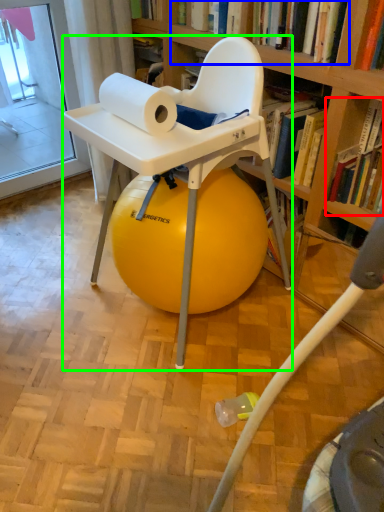
Question: Based on their relative distances, which object is farther from book (highlighted by a red box)? Choose from book (highlighted by a blue box) and chair (highlighted by a green box).

Choices:
 (A) book
 (B) chair

Answer: (B)